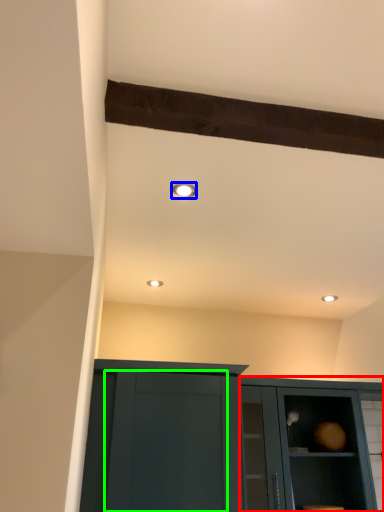
Question: Which object is positioned farthest from cabinetry (highlighted by a red box)? Select from lighting (highlighted by a blue box) and glass door (highlighted by a green box).

Choices:
 (A) lighting
 (B) glass door

Answer: (A)